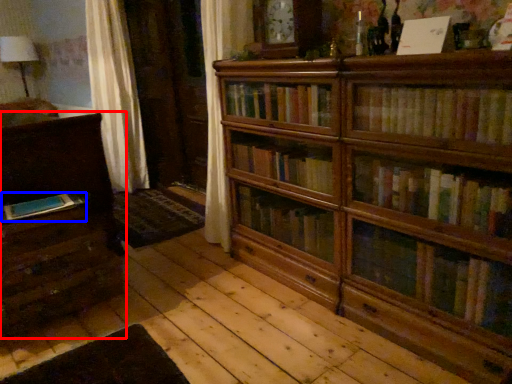
Question: Which point is closer to the camera, chest of drawers (highlighted by a red box) or book (highlighted by a blue box)?

Choices:
 (A) chest of drawers
 (B) book

Answer: (B)